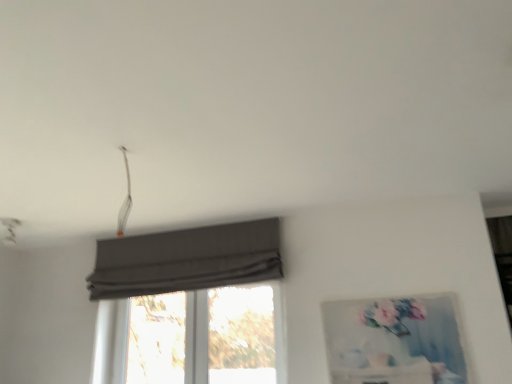
Measure the distance between dark gray fabric curtain at center and camera.

dark gray fabric curtain at center and camera are 9.38 feet apart.

Where is `dark gray fabric curtain at center`? This screenshot has height=384, width=512. dark gray fabric curtain at center is located at coordinates (187, 260).

Is dark gray fabric curtain at center far from transparent glass window at center?

No, dark gray fabric curtain at center is not far from transparent glass window at center.

From a real-world perspective, does dark gray fabric curtain at center sit lower than transparent glass window at center?

No.

Considering the relative sizes of dark gray fabric curtain at center and transparent glass window at center in the image provided, is dark gray fabric curtain at center taller than transparent glass window at center?

In fact, dark gray fabric curtain at center may be shorter than transparent glass window at center.

Is dark gray fabric curtain at center outside of transparent glass window at center?

dark gray fabric curtain at center is positioned outside transparent glass window at center.

From the picture: Is dark gray fabric curtain at center outside of matte gray picture frame at right?

Yes, dark gray fabric curtain at center is not within matte gray picture frame at right.

Image resolution: width=512 pixels, height=384 pixels. I want to click on picture frame on the right of dark gray fabric curtain at center, so click(394, 340).

From the image's perspective, is dark gray fabric curtain at center located beneath matte gray picture frame at right?

Incorrect, from the image's perspective, dark gray fabric curtain at center is higher than matte gray picture frame at right.

Can you confirm if matte gray picture frame at right is bigger than transparent glass window at center?

No, matte gray picture frame at right is not bigger than transparent glass window at center.

Is matte gray picture frame at right completely or partially outside of transparent glass window at center?

Yes, matte gray picture frame at right is not within transparent glass window at center.

Is matte gray picture frame at right further to the viewer compared to transparent glass window at center?

No, matte gray picture frame at right is in front of transparent glass window at center.

Based on the photo, is matte gray picture frame at right placed right next to transparent glass window at center?

No, matte gray picture frame at right is not next to transparent glass window at center.

Is transparent glass window at center placed right next to matte gray picture frame at right?

transparent glass window at center and matte gray picture frame at right are not in contact.

In terms of height, does transparent glass window at center look taller or shorter compared to matte gray picture frame at right?

transparent glass window at center is taller than matte gray picture frame at right.

From a real-world perspective, is transparent glass window at center above or below matte gray picture frame at right?

In terms of real-world spatial position, transparent glass window at center is above matte gray picture frame at right.

Does matte gray picture frame at right touch dark gray fabric curtain at center?

No, matte gray picture frame at right is not in contact with dark gray fabric curtain at center.

Considering the positions of objects matte gray picture frame at right and dark gray fabric curtain at center in the image provided, who is behind, matte gray picture frame at right or dark gray fabric curtain at center?

dark gray fabric curtain at center.

In the scene shown: From a real-world perspective, is matte gray picture frame at right located higher than dark gray fabric curtain at center?

Actually, matte gray picture frame at right is physically below dark gray fabric curtain at center in the real world.

Looking at this image, from the image's perspective, is matte gray picture frame at right below dark gray fabric curtain at center?

Indeed, from the image's perspective, matte gray picture frame at right is shown beneath dark gray fabric curtain at center.

How different are the orientations of transparent glass window at center and dark gray fabric curtain at center in degrees?

0.000497 degrees.

Based on the photo, which object is more forward, transparent glass window at center or dark gray fabric curtain at center?

dark gray fabric curtain at center.

From a real-world perspective, which object stands above the other?

In real-world perspective, dark gray fabric curtain at center is above.

Does transparent glass window at center appear on the right side of dark gray fabric curtain at center?

Yes, transparent glass window at center is to the right of dark gray fabric curtain at center.

At what (x,y) coordinates should I click in order to perform the action: click on curtain that appears in front of the transparent glass window at center. Please return your answer as a coordinate pair (x, y). Looking at the image, I should click on (187, 260).

Identify the location of curtain located behind the matte gray picture frame at right. (187, 260).

Based on their spatial positions, is transparent glass window at center or matte gray picture frame at right further from dark gray fabric curtain at center?

Based on the image, matte gray picture frame at right appears to be further to dark gray fabric curtain at center.

Considering their positions, is dark gray fabric curtain at center positioned further to matte gray picture frame at right than transparent glass window at center?

The object further to matte gray picture frame at right is dark gray fabric curtain at center.

From the image, which object appears to be nearer to matte gray picture frame at right, transparent glass window at center or dark gray fabric curtain at center?

transparent glass window at center is closer to matte gray picture frame at right.

From the image, which object appears to be nearer to transparent glass window at center, dark gray fabric curtain at center or matte gray picture frame at right?

Among the two, dark gray fabric curtain at center is located nearer to transparent glass window at center.

Looking at the image, which one is located closer to transparent glass window at center, matte gray picture frame at right or dark gray fabric curtain at center?

The object closer to transparent glass window at center is dark gray fabric curtain at center.

Estimate the real-world distances between objects in this image. Which object is further from dark gray fabric curtain at center, matte gray picture frame at right or transparent glass window at center?

matte gray picture frame at right is further to dark gray fabric curtain at center.

At what (x,y) coordinates should I click in order to perform the action: click on window between dark gray fabric curtain at center and matte gray picture frame at right in the horizontal direction. Please return your answer as a coordinate pair (x, y). This screenshot has height=384, width=512. Looking at the image, I should click on (205, 337).